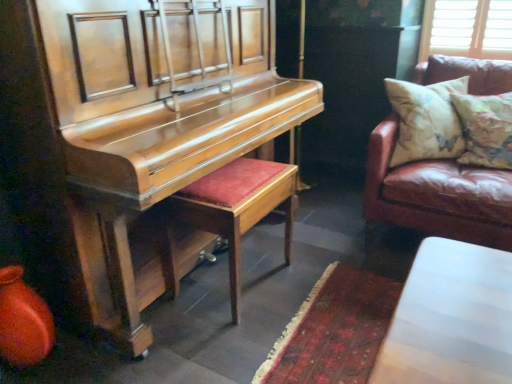
At what (x,y) coordinates should I click in order to perform the action: click on free spot above velvet red stool at center (from a real-world perspective). Please return your answer as a coordinate pair (x, y). Looking at the image, I should click on (236, 177).